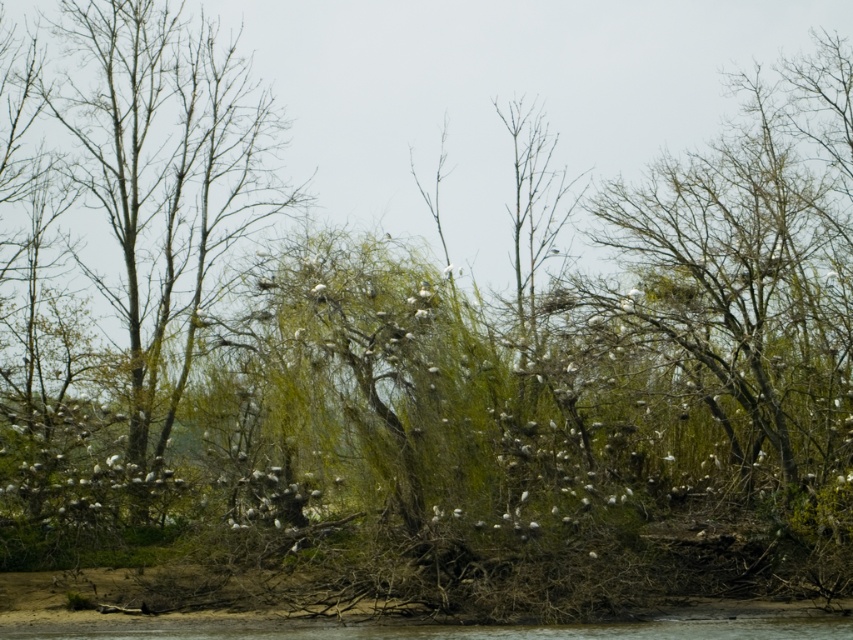
Is point (274, 113) more distant than point (486, 632)?

Yes, it is.

Does bare branches at left appear over brown muddy river at lower center?

Yes.

The height and width of the screenshot is (640, 853). What are the coordinates of `bare branches at left` in the screenshot? It's located at (161, 198).